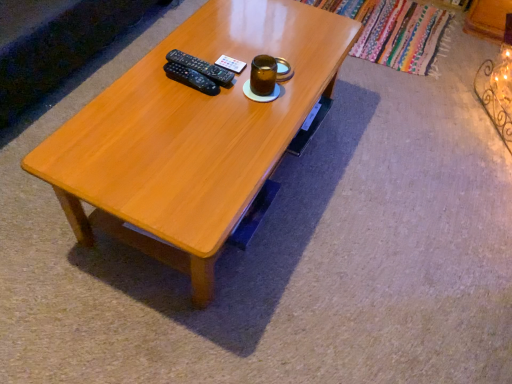
Question: Can you confirm if light brown wood coffee table at center is shorter than brown glass jar at upper center?

Choices:
 (A) yes
 (B) no

Answer: (B)

Question: From a real-world perspective, is light brown wood coffee table at center physically below brown glass jar at upper center?

Choices:
 (A) no
 (B) yes

Answer: (B)

Question: From a real-world perspective, is light brown wood coffee table at center positioned over brown glass jar at upper center based on gravity?

Choices:
 (A) yes
 (B) no

Answer: (B)

Question: Is light brown wood coffee table at center taller than brown glass jar at upper center?

Choices:
 (A) yes
 (B) no

Answer: (A)

Question: From the image's perspective, is light brown wood coffee table at center located beneath brown glass jar at upper center?

Choices:
 (A) no
 (B) yes

Answer: (B)

Question: Does light brown wood coffee table at center come in front of brown glass jar at upper center?

Choices:
 (A) no
 (B) yes

Answer: (B)

Question: Considering the relative sizes of black plastic remote at center and brown glass jar at upper center in the image provided, is black plastic remote at center smaller than brown glass jar at upper center?

Choices:
 (A) yes
 (B) no

Answer: (A)

Question: Is the position of black plastic remote at center less distant than that of brown glass jar at upper center?

Choices:
 (A) yes
 (B) no

Answer: (B)

Question: From the image's perspective, is black plastic remote at center located beneath brown glass jar at upper center?

Choices:
 (A) yes
 (B) no

Answer: (B)

Question: Is black plastic remote at center wider than brown glass jar at upper center?

Choices:
 (A) yes
 (B) no

Answer: (A)

Question: Is black plastic remote at center touching brown glass jar at upper center?

Choices:
 (A) no
 (B) yes

Answer: (A)

Question: Does black plastic remote at center contain brown glass jar at upper center?

Choices:
 (A) no
 (B) yes

Answer: (A)

Question: Is light brown wood coffee table at center to the left of black plastic remote at center from the viewer's perspective?

Choices:
 (A) yes
 (B) no

Answer: (B)